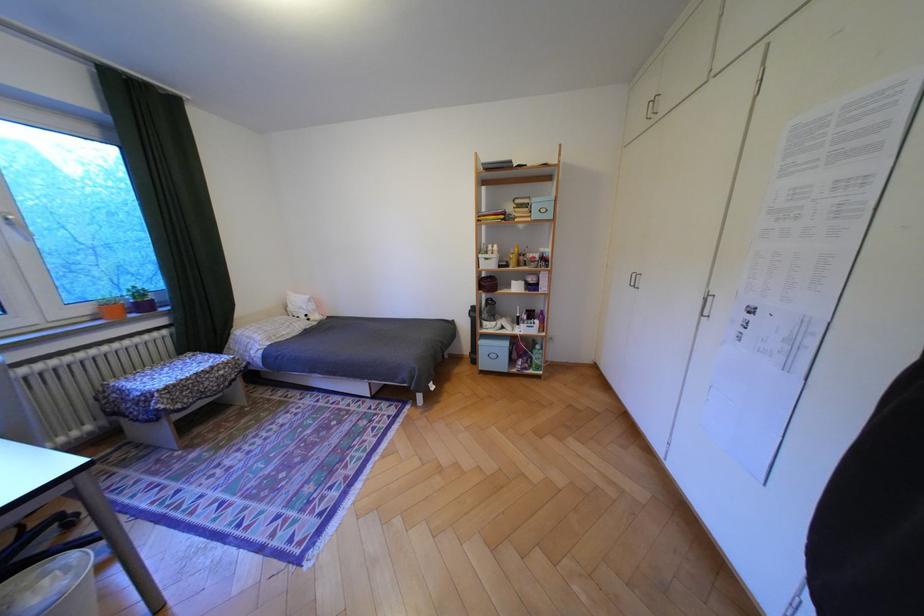
Find the location of a particular element. white window handle is located at coordinates (14, 224).